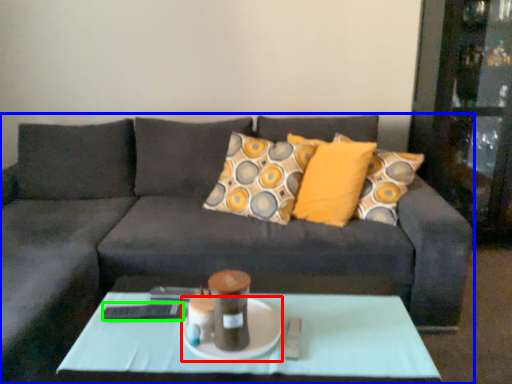
Question: Based on their relative distances, which object is nearer to glass plate (highlighted by a red box)? Choose from studio couch (highlighted by a blue box) and remote (highlighted by a green box).

Choices:
 (A) studio couch
 (B) remote

Answer: (B)